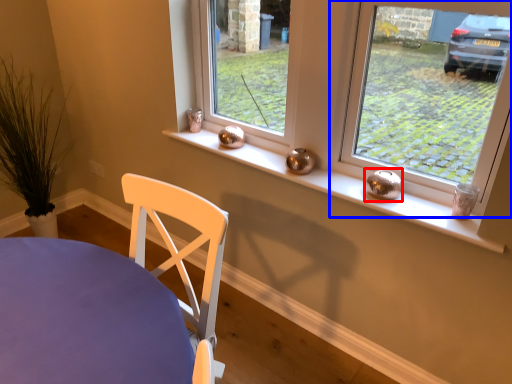
Question: Which of the following is the farthest to the observer, candle holder (highlighted by a red box) or window (highlighted by a blue box)?

Choices:
 (A) candle holder
 (B) window

Answer: (A)